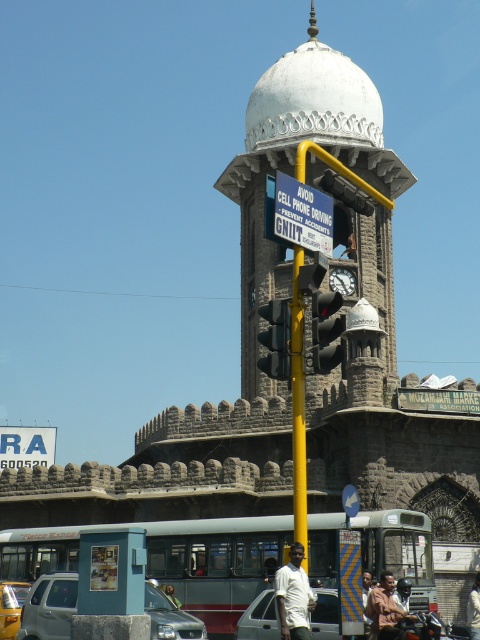
Does point (321, 592) come in front of point (377, 609)?

No.

Does metallic gray sedan at center appear over light brown leather jacket at lower center?

No, metallic gray sedan at center is not above light brown leather jacket at lower center.

Locate an element on the screen. The width and height of the screenshot is (480, 640). metallic gray sedan at center is located at coordinates (260, 618).

Is white stone clock tower at center wider than metallic rectangular sign at center?

Indeed, white stone clock tower at center has a greater width compared to metallic rectangular sign at center.

Describe the element at coordinates (294, 166) in the screenshot. Image resolution: width=480 pixels, height=640 pixels. I see `white stone clock tower at center` at that location.

Where is `white stone clock tower at center`? Image resolution: width=480 pixels, height=640 pixels. white stone clock tower at center is located at coordinates (294, 166).

Can you confirm if metallic rectangular sign at center is wider than light brown leather jacket at lower center?

Yes.

Does metallic rectangular sign at center have a smaller size compared to light brown leather jacket at lower center?

Incorrect, metallic rectangular sign at center is not smaller in size than light brown leather jacket at lower center.

Where is `metallic rectangular sign at center`? The height and width of the screenshot is (640, 480). metallic rectangular sign at center is located at coordinates (302, 214).